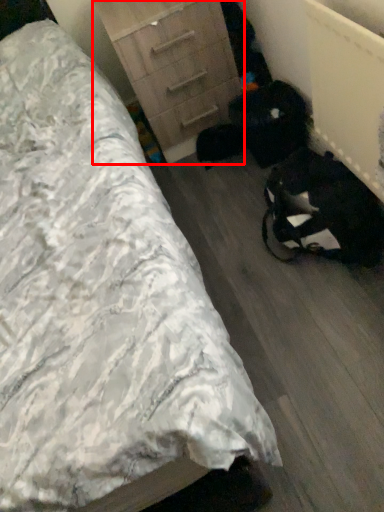
Question: In this image, where is chest of drawers (annotated by the red box) located relative to bed?

Choices:
 (A) right
 (B) left

Answer: (A)